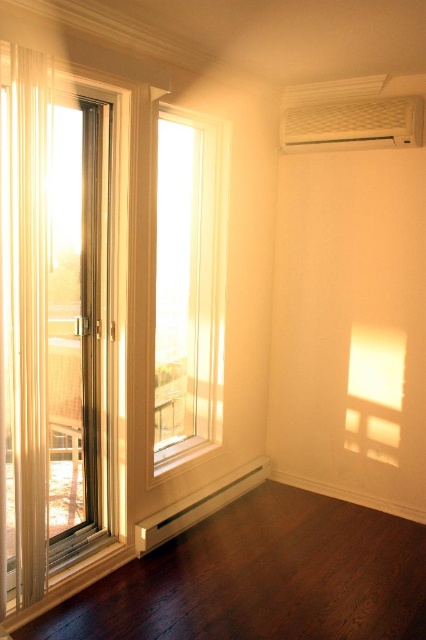
You are standing in the room and want to exit through the clear glass screen door at left. Based on the room layout, where should you head to reach it?

The clear glass screen door at left is located at point (55,336), so you should head towards the left side of the room to reach it.